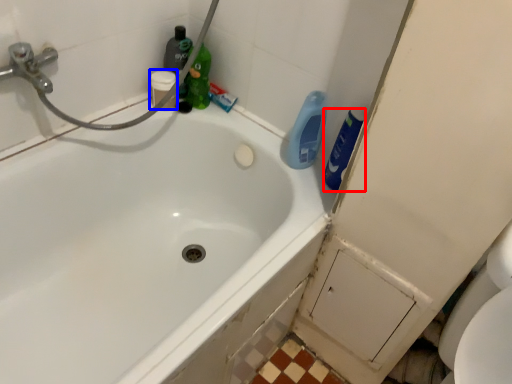
Question: Which object appears farthest to the camera in this image, cleaning product (highlighted by a red box) or toiletry (highlighted by a blue box)?

Choices:
 (A) cleaning product
 (B) toiletry

Answer: (B)